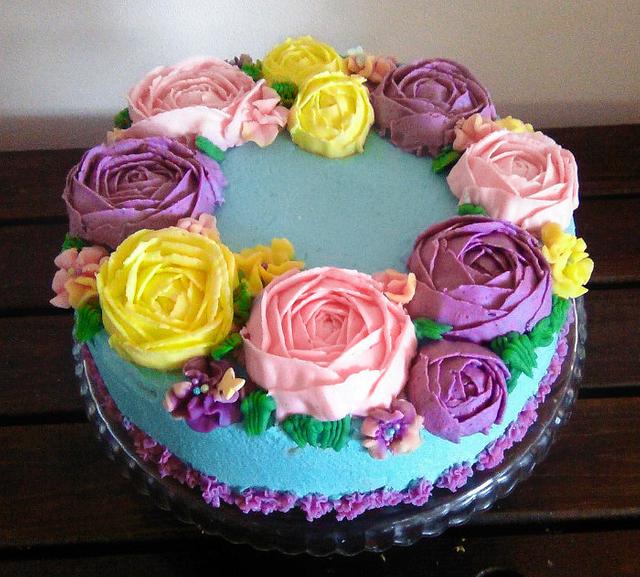
I want to click on wooden table, so click(54, 364).